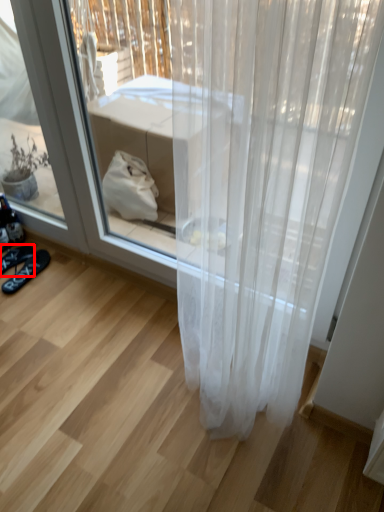
Question: From the image's perspective, considering the relative positions of footwear (annotated by the red box) and footwear in the image provided, where is footwear (annotated by the red box) located with respect to the staircase?

Choices:
 (A) above
 (B) below

Answer: (A)